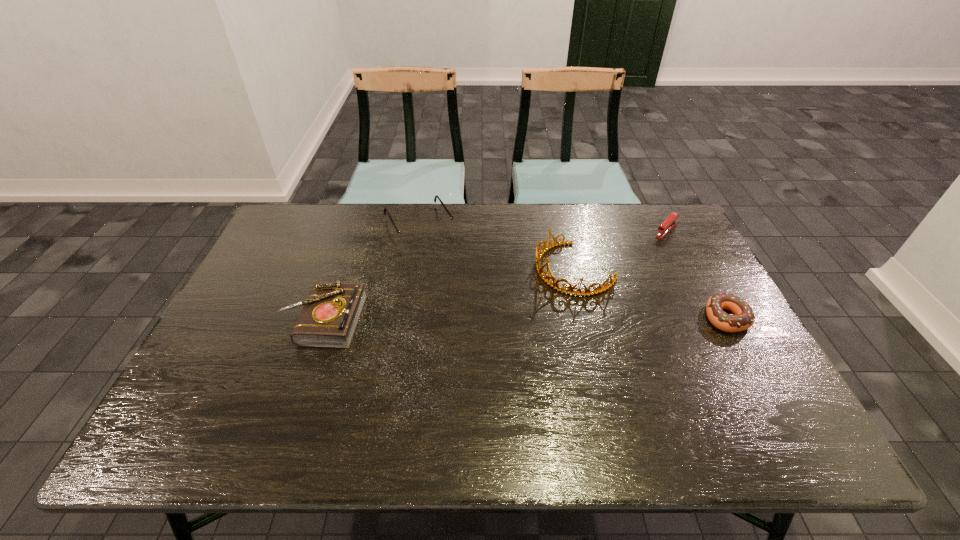
The width and height of the screenshot is (960, 540). I want to click on doughnut located at the right edge, so click(744, 317).

Locate an element on the screen. The height and width of the screenshot is (540, 960). stapler located at the right edge is located at coordinates (668, 224).

Find the location of a particular element. object at the far right corner is located at coordinates (668, 224).

The image size is (960, 540). In order to click on free space at the far edge of the desktop in this screenshot , I will do `click(493, 234)`.

This screenshot has height=540, width=960. I want to click on free space at the near edge of the desktop, so click(689, 391).

You are a GUI agent. You are given a task and a screenshot of the screen. Output one action in this format:
    pyautogui.click(x=<x>, y=<y>)
    Task: Click on the vacant space at the left edge
    
    Given the screenshot: What is the action you would take?
    pyautogui.click(x=249, y=338)

The image size is (960, 540). In order to click on vacant space at the right edge in this screenshot , I will do `click(693, 289)`.

The width and height of the screenshot is (960, 540). In the image, there is a desktop. Find the location of `blank space at the far right corner`. blank space at the far right corner is located at coordinates (666, 241).

The width and height of the screenshot is (960, 540). Identify the location of blank space at the near right corner of the desktop. (715, 382).

Where is `free area in between the third object from left to right and the spectacles`? The image size is (960, 540). free area in between the third object from left to right and the spectacles is located at coordinates (497, 247).